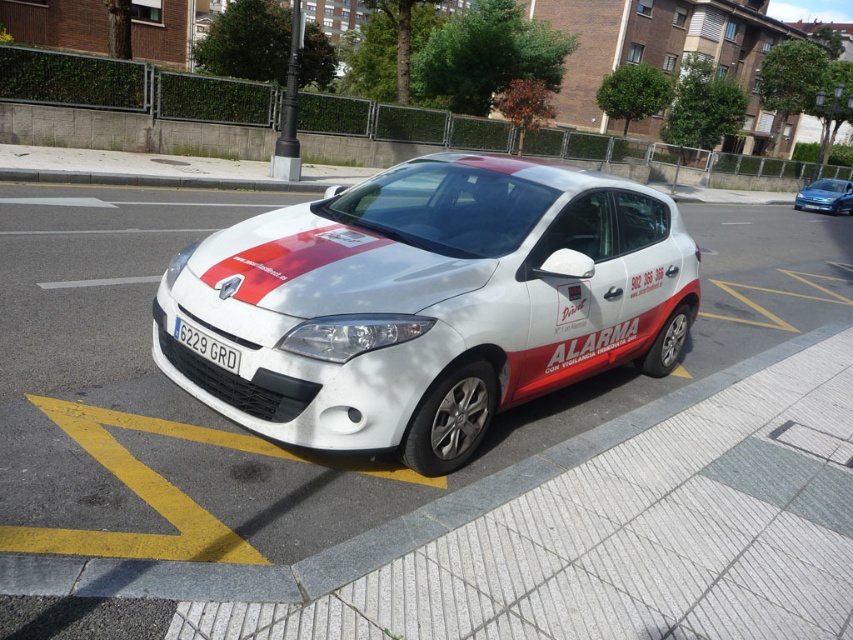
Please provide the exact coordinates of the white matte hatchback at center in the image. The coordinate system is defined with the origin at the bottom left corner of the image, with x and y axes increasing to the right and up respectively. The coordinates are normalized between 0 and 1.

The white matte hatchback at center is located at coordinates point (x=825, y=196).

You are a delivery person trying to park your van next to the white glossy hatchback at center. The parking space next to it is exactly the same size as the white plastic license plate at center. Will your van fit in the space?

The white glossy hatchback at center is bigger than the white plastic license plate at center, so the parking space next to it, which is the same size as the license plate, is too small for the van. Your van will not fit in the space.